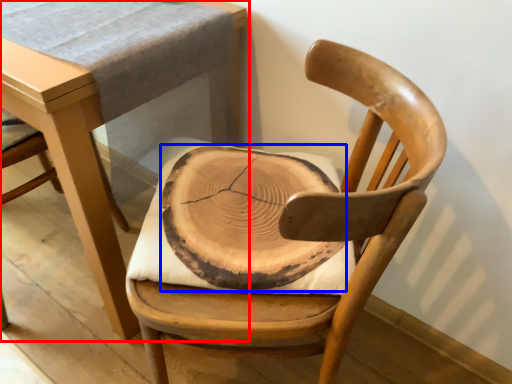
Question: Which point is closer to the camera, table (highlighted by a red box) or pad (highlighted by a blue box)?

Choices:
 (A) table
 (B) pad

Answer: (A)